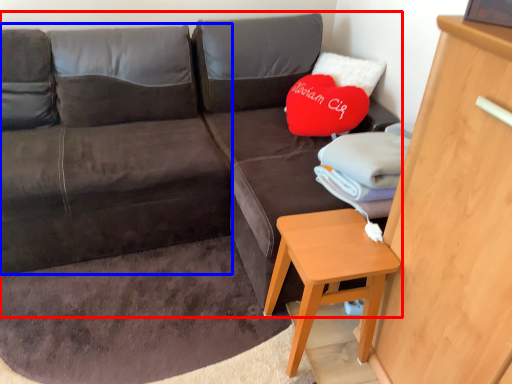
Question: Which object is closer to the camera taking this photo, studio couch (highlighted by a red box) or bean bag chair (highlighted by a blue box)?

Choices:
 (A) studio couch
 (B) bean bag chair

Answer: (A)